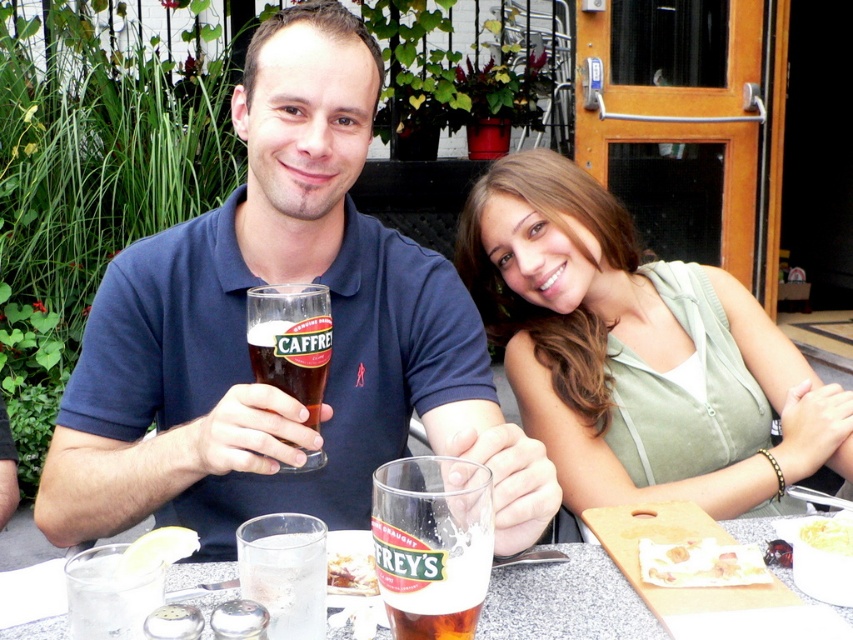
Is dark brown glass at center bigger than white creamy bread at lower right?

Correct, dark brown glass at center is larger in size than white creamy bread at lower right.

Is dark brown glass at center positioned before white creamy bread at lower right?

Yes, it is.

Measure the distance between dark brown glass at center and camera.

They are 81.19 centimeters apart.

Identify the location of dark brown glass at center. (291, 340).

Who is more forward, (422, 484) or (326, 296)?

Point (422, 484) is in front.

What do you see at coordinates (432, 545) in the screenshot? The width and height of the screenshot is (853, 640). I see `translucent glass mug at center` at bounding box center [432, 545].

Between point (430, 541) and point (291, 332), which one is positioned in front?

Point (430, 541) is in front.

The height and width of the screenshot is (640, 853). I want to click on translucent glass mug at center, so click(x=432, y=545).

Is point (486, 564) more distant than point (844, 541)?

No, (486, 564) is closer to viewer.

Does translucent glass mug at center have a lesser height compared to yellow crumbly cheese at center?

In fact, translucent glass mug at center may be taller than yellow crumbly cheese at center.

Locate an element on the screen. This screenshot has height=640, width=853. translucent glass mug at center is located at coordinates (432, 545).